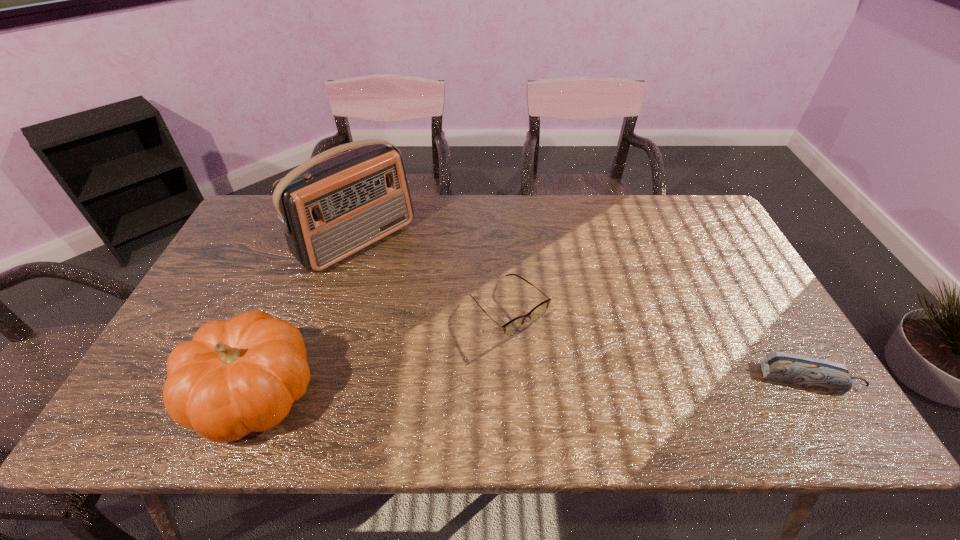
Find the location of `vacant space in between the spectacles and the rightmost object`. vacant space in between the spectacles and the rightmost object is located at coordinates (659, 343).

The height and width of the screenshot is (540, 960). I want to click on vacant area that lies between the rightmost object and the second tallest object, so click(532, 386).

Locate an element on the screen. The image size is (960, 540). free space between the second object from right to left and the pumpkin is located at coordinates click(382, 350).

Find the location of a particular element. The width and height of the screenshot is (960, 540). empty space between the spectacles and the pumpkin is located at coordinates (382, 350).

This screenshot has width=960, height=540. What are the coordinates of `vacant space in between the third object from left to right and the pumpkin` in the screenshot? It's located at (382, 350).

Select which object appears as the second closest to the second object from right to left. Please provide its 2D coordinates. Your answer should be formatted as a tuple, i.e. [(x, y)], where the tuple contains the x and y coordinates of a point satisfying the conditions above.

[(237, 376)]

Locate which object is the second closest to the rightmost object. Please provide its 2D coordinates. Your answer should be formatted as a tuple, i.e. [(x, y)], where the tuple contains the x and y coordinates of a point satisfying the conditions above.

[(329, 209)]

The width and height of the screenshot is (960, 540). What are the coordinates of `vacant region that satisfies the following two spatial constraints: 1. on the front side of the pencil box; 2. on the right side of the tallest object` in the screenshot? It's located at (316, 379).

The image size is (960, 540). What are the coordinates of `blank space that satisfies the following two spatial constraints: 1. on the front side of the pencil box; 2. on the left side of the second object from right to left` in the screenshot? It's located at (513, 379).